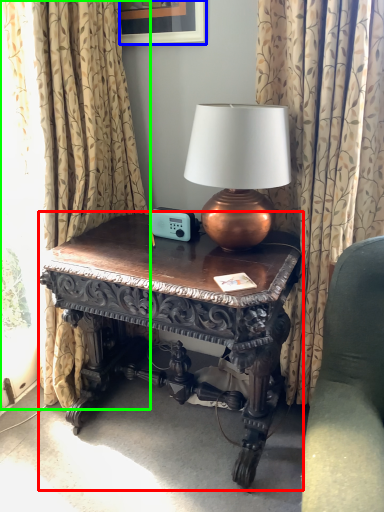
Question: Based on their relative distances, which object is farther from table (highlighted by a red box)? Choose from picture frame (highlighted by a blue box) and curtain (highlighted by a green box).

Choices:
 (A) picture frame
 (B) curtain

Answer: (A)